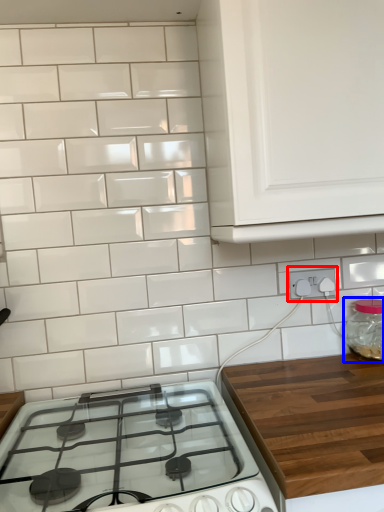
Question: Which object is further to the camera taking this photo, electric outlet (highlighted by a red box) or glass jar (highlighted by a blue box)?

Choices:
 (A) electric outlet
 (B) glass jar

Answer: (A)